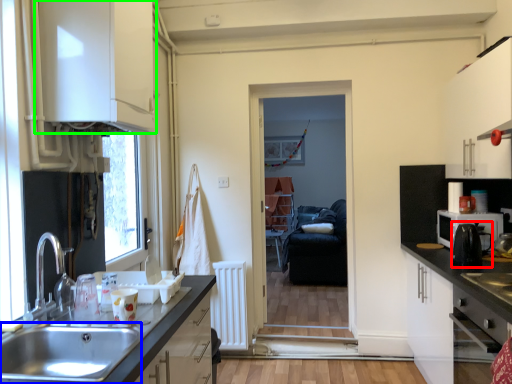
Question: Which object is positioned farthest from coffee machine (highlighted by a red box)? Select from sink (highlighted by a blue box) and cabinetry (highlighted by a green box).

Choices:
 (A) sink
 (B) cabinetry

Answer: (B)